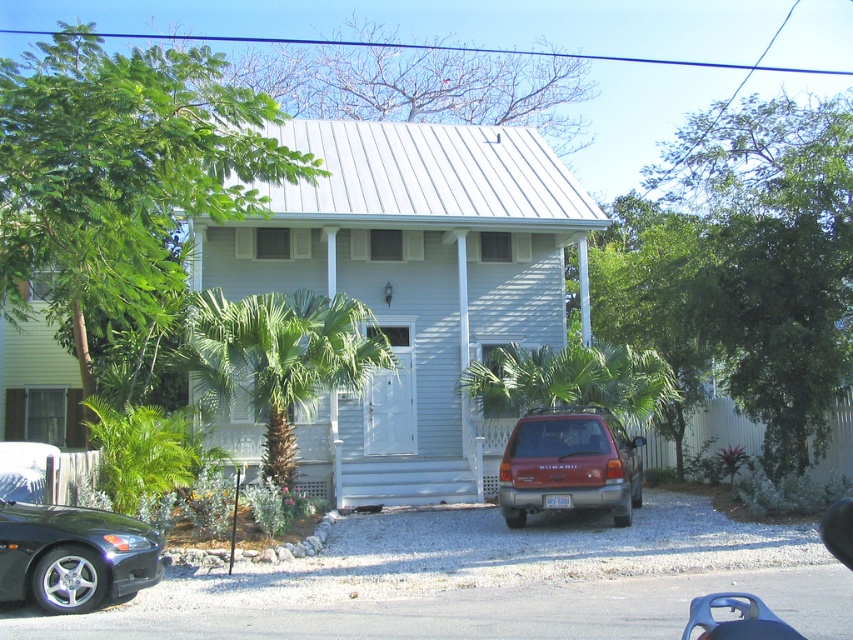
Between green leafy palm tree at center and shiny black car at lower left, which one has less height?

With less height is shiny black car at lower left.

Does green leafy palm tree at center come behind shiny black car at lower left?

Yes, green leafy palm tree at center is behind shiny black car at lower left.

The height and width of the screenshot is (640, 853). I want to click on green leafy palm tree at center, so click(x=277, y=358).

Which is more to the right, gray asphalt driveway at lower center or shiny black car at lower left?

gray asphalt driveway at lower center is more to the right.

Is the position of gray asphalt driveway at lower center less distant than that of shiny black car at lower left?

Yes.

Is point (447, 620) positioned in front of point (9, 570)?

Yes, it is in front of point (9, 570).

I want to click on gray asphalt driveway at lower center, so click(x=489, y=611).

Does gray asphalt driveway at lower center come in front of green leafy palm tree at center?

That is True.

Does gray asphalt driveway at lower center have a lesser width compared to green leafy palm tree at center?

Yes, gray asphalt driveway at lower center is thinner than green leafy palm tree at center.

Between point (825, 602) and point (245, 326), which one is positioned behind?

Positioned behind is point (245, 326).

You are a GUI agent. You are given a task and a screenshot of the screen. Output one action in this format:
    pyautogui.click(x=<x>, y=<y>)
    Task: Click on the gray asphalt driveway at lower center
    
    Given the screenshot: What is the action you would take?
    pyautogui.click(x=489, y=611)